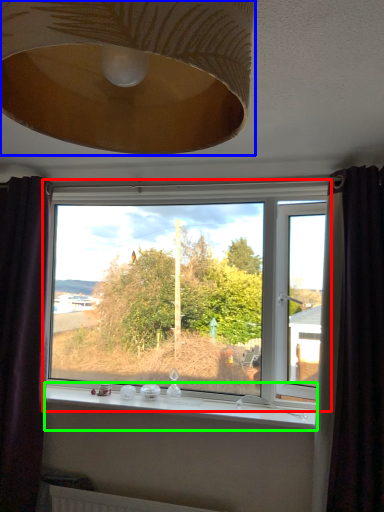
Question: Estimate the real-world distances between objects in this image. Which object is farther from window (highlighted by a red box), lamp (highlighted by a blue box) or window sill (highlighted by a green box)?

Choices:
 (A) lamp
 (B) window sill

Answer: (A)